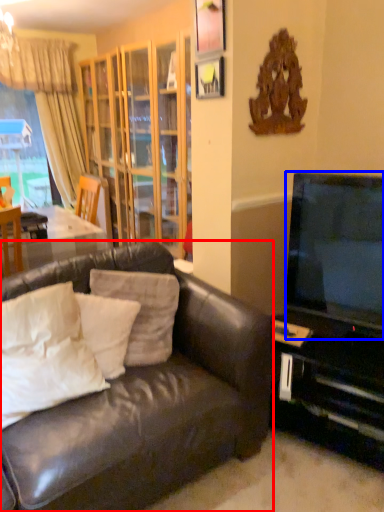
Question: Among these objects, which one is nearest to the camera, studio couch (highlighted by a red box) or television (highlighted by a blue box)?

Choices:
 (A) studio couch
 (B) television

Answer: (A)